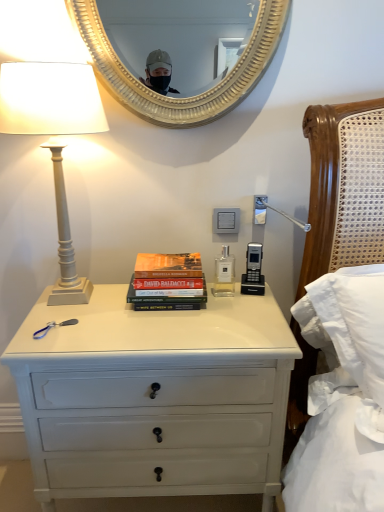
Question: Is white matte column lamp at left outside of gold textured mirror at upper center?

Choices:
 (A) no
 (B) yes

Answer: (B)

Question: Does white matte column lamp at left come in front of gold textured mirror at upper center?

Choices:
 (A) yes
 (B) no

Answer: (A)

Question: Is the position of white matte column lamp at left more distant than that of gold textured mirror at upper center?

Choices:
 (A) yes
 (B) no

Answer: (B)

Question: From a real-world perspective, is white matte column lamp at left below gold textured mirror at upper center?

Choices:
 (A) yes
 (B) no

Answer: (A)

Question: Is white matte column lamp at left wider than gold textured mirror at upper center?

Choices:
 (A) yes
 (B) no

Answer: (A)

Question: Is the surface of white matte column lamp at left in direct contact with gold textured mirror at upper center?

Choices:
 (A) no
 (B) yes

Answer: (A)

Question: Is white matte column lamp at left far away from white plastic power outlet at center?

Choices:
 (A) yes
 (B) no

Answer: (B)

Question: From the image's perspective, is white matte column lamp at left located above white plastic power outlet at center?

Choices:
 (A) yes
 (B) no

Answer: (A)

Question: Can you confirm if white matte column lamp at left is wider than white plastic power outlet at center?

Choices:
 (A) yes
 (B) no

Answer: (A)

Question: From a real-world perspective, does white matte column lamp at left sit lower than white plastic power outlet at center?

Choices:
 (A) yes
 (B) no

Answer: (B)

Question: Could you tell me if white matte column lamp at left is turned towards white plastic power outlet at center?

Choices:
 (A) yes
 (B) no

Answer: (B)

Question: Does white matte column lamp at left come in front of white plastic power outlet at center?

Choices:
 (A) no
 (B) yes

Answer: (B)

Question: From a real-world perspective, is gold textured mirror at upper center beneath hardcover books at center?

Choices:
 (A) no
 (B) yes

Answer: (A)